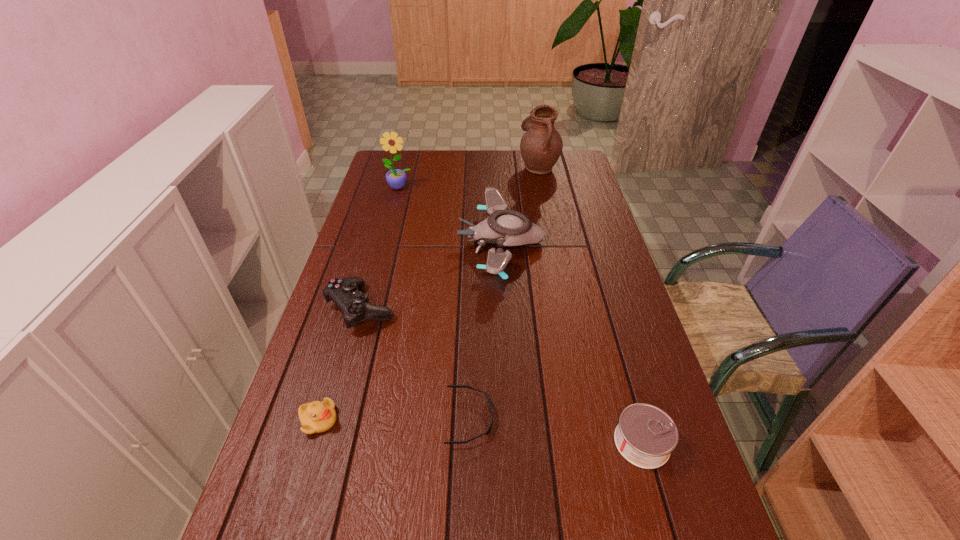
The height and width of the screenshot is (540, 960). Find the location of `blank area located 0.090m on the front-facing side of the sunflower`. blank area located 0.090m on the front-facing side of the sunflower is located at coordinates (395, 205).

You are a GUI agent. You are given a task and a screenshot of the screen. Output one action in this format:
    pyautogui.click(x=<x>, y=<y>)
    Task: Click on the free space located on the front-facing side of the drone
    The width and height of the screenshot is (960, 540).
    Given the screenshot: What is the action you would take?
    pyautogui.click(x=437, y=242)

The height and width of the screenshot is (540, 960). Find the location of `vacant space situated on the front-facing side of the drone`. vacant space situated on the front-facing side of the drone is located at coordinates (358, 242).

Where is `free region located 0.130m on the front-facing side of the drone`? Image resolution: width=960 pixels, height=540 pixels. free region located 0.130m on the front-facing side of the drone is located at coordinates (419, 242).

Identify the location of free space located on the front of the control. (335, 400).

Identify the location of vacant position located on the front-facing side of the duckling. (414, 420).

The height and width of the screenshot is (540, 960). In order to click on vacant area located on the left of the can in this screenshot , I will do click(425, 443).

The height and width of the screenshot is (540, 960). In order to click on vacant space situated on the front-facing side of the sunglasses in this screenshot , I will do `click(584, 418)`.

Where is `object located in the far edge section of the desktop`? object located in the far edge section of the desktop is located at coordinates (541, 145).

This screenshot has height=540, width=960. I want to click on sunflower that is at the left edge, so click(x=396, y=178).